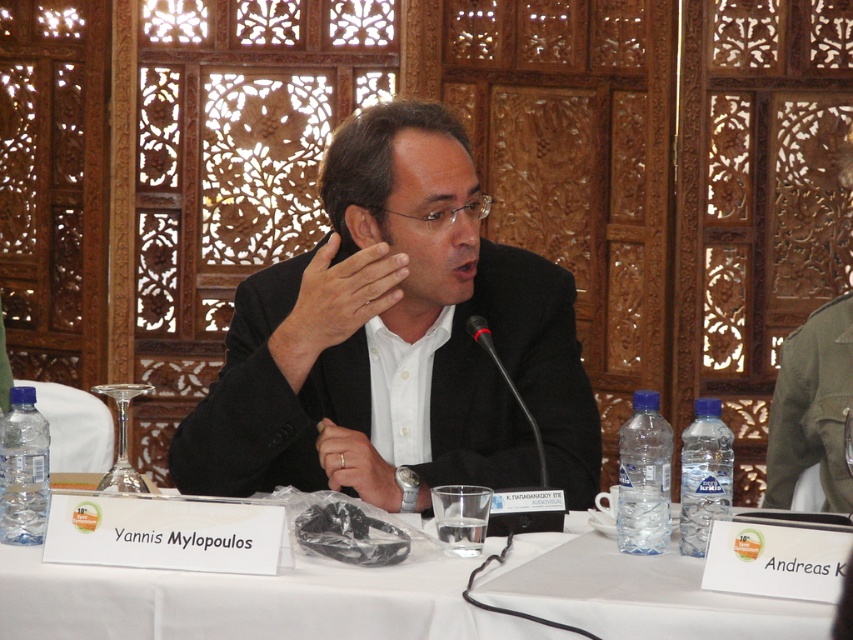
Question: Can you confirm if white cloth at center is positioned above smooth skin hand at center?

Choices:
 (A) yes
 (B) no

Answer: (B)

Question: Which point appears farthest from the camera in this image?

Choices:
 (A) (343, 317)
 (B) (708, 634)
 (C) (364, 432)

Answer: (C)

Question: Which point is closer to the camera taking this photo?

Choices:
 (A) (664, 588)
 (B) (294, 333)
 (C) (370, 474)
 (D) (306, 365)

Answer: (A)

Question: Can you confirm if white cloth at center is positioned to the right of white leather watch at center?

Choices:
 (A) no
 (B) yes

Answer: (B)

Question: Is white cloth at center positioned before smooth skin hand at center?

Choices:
 (A) no
 (B) yes

Answer: (B)

Question: Estimate the real-world distances between objects in this image. Which object is closer to the white cloth at center?

Choices:
 (A) black matte suit at center
 (B) white leather watch at center
 (C) smooth skin hand at center

Answer: (B)